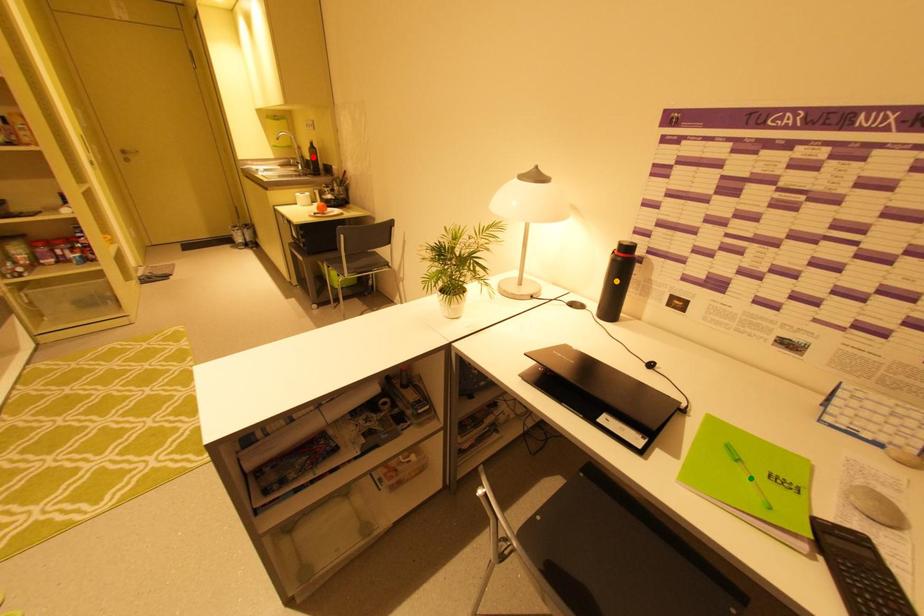
Order these from nearest to farthest:
- red point
- orange point
- green point

1. red point
2. orange point
3. green point